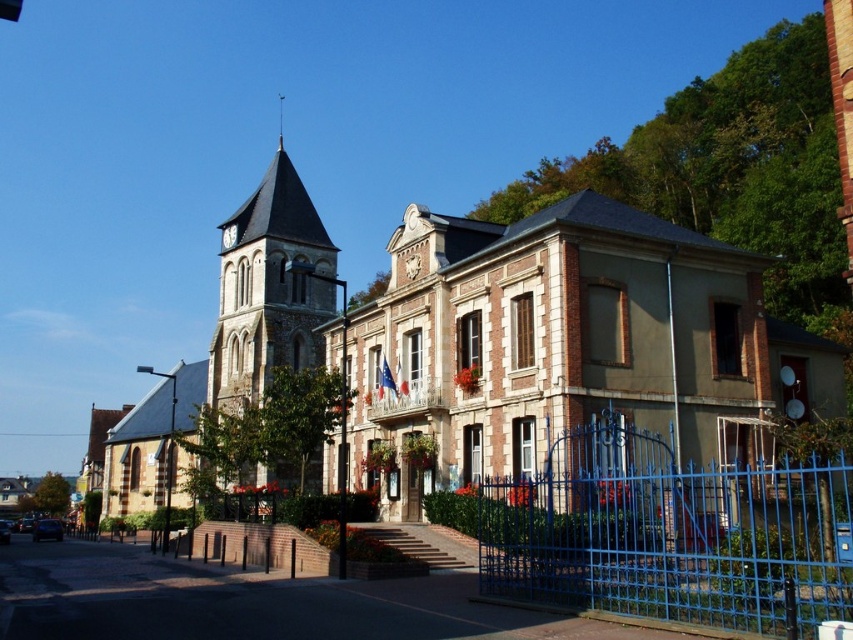
You are standing in front of the historic building complex and want to enter through the main entrance. Where is the blue metal gate at center located relative to the main entrance?

The blue metal gate at center is located at point (672,532) relative to the main entrance.

You are a visitor standing at the entrance of the historic building complex and want to take a photo of the blue metal gate at center and the white clock tower at upper center. Which object appears taller in the photo?

The blue metal gate at center appears taller in the photo than the white clock tower at upper center because the blue metal gate at center is much taller as white clock tower at upper center.